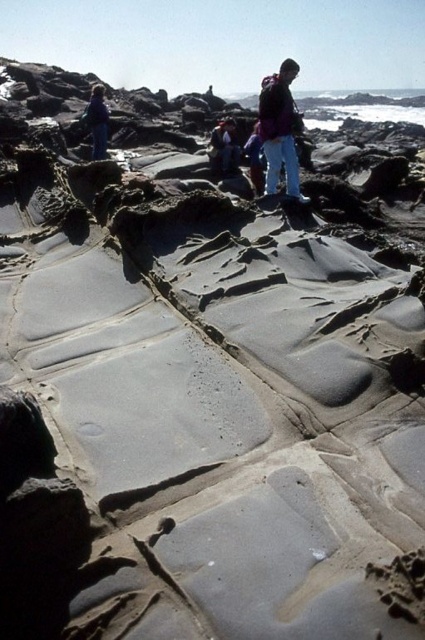
Question: Does purple fleece jacket at upper center have a lesser width compared to blue denim jacket at left?

Choices:
 (A) no
 (B) yes

Answer: (A)

Question: From the image, what is the correct spatial relationship of purple fleece jacket at upper center in relation to blue denim jacket at left?

Choices:
 (A) left
 (B) right

Answer: (B)

Question: Among these objects, which one is farthest from the camera?

Choices:
 (A) denim jacket at center
 (B) purple fleece jacket at upper center

Answer: (A)

Question: Which object is closer to the camera taking this photo?

Choices:
 (A) blue denim jacket at left
 (B) blue jeans at center

Answer: (B)

Question: Which of these objects is positioned closest to the blue denim jacket at left?

Choices:
 (A) purple fleece jacket at upper center
 (B) denim jacket at center
 (C) blue jeans at center

Answer: (B)

Question: Can you confirm if denim jacket at center is positioned above blue denim jacket at left?

Choices:
 (A) yes
 (B) no

Answer: (B)